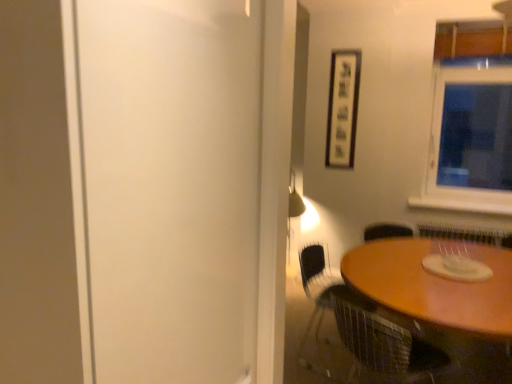
You are a GUI agent. You are given a task and a screenshot of the screen. Output one action in this format:
    pyautogui.click(x=<x>, y=<y>)
    Task: Click on the vacant space underneath transparent glass window at upper right (from a real-world perspective)
    The width and height of the screenshot is (512, 384).
    Given the screenshot: What is the action you would take?
    pyautogui.click(x=464, y=197)